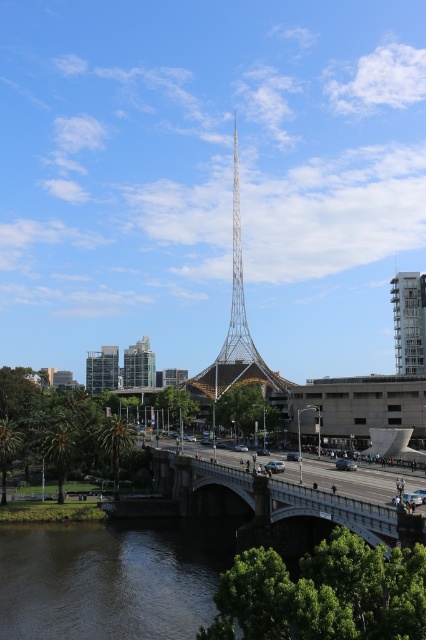
Can you confirm if metallic lattice tower at center is positioned to the left of white glass building at right?

Correct, you'll find metallic lattice tower at center to the left of white glass building at right.

Can you confirm if metallic lattice tower at center is thinner than white glass building at right?

Incorrect, metallic lattice tower at center's width is not less than white glass building at right's.

Is point (236, 140) positioned behind point (417, 316)?

Yes, it is.

Where is `metallic lattice tower at center`? The height and width of the screenshot is (640, 426). metallic lattice tower at center is located at coordinates (236, 332).

Is glassy modern building at center shorter than glassy reflective building at left?

No.

This screenshot has width=426, height=640. What do you see at coordinates (138, 364) in the screenshot?
I see `glassy modern building at center` at bounding box center [138, 364].

I want to click on glassy modern building at center, so click(138, 364).

Find the location of a particular element. metallic lattice tower at center is located at coordinates (236, 332).

Who is positioned more to the right, metallic lattice tower at center or glassy reflective building at left?

metallic lattice tower at center

Where is `metallic lattice tower at center`? This screenshot has height=640, width=426. metallic lattice tower at center is located at coordinates [236, 332].